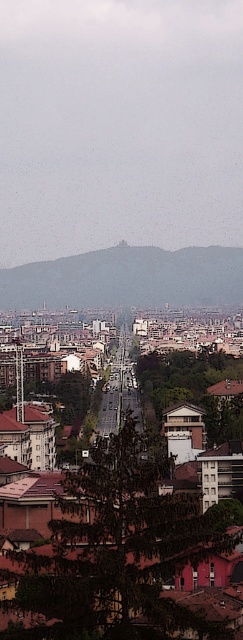
Is the position of brown tiled roofs at center less distant than that of gray stone hillside at center?

Yes, it is.

This screenshot has width=243, height=640. Describe the element at coordinates (121, 532) in the screenshot. I see `brown tiled roofs at center` at that location.

Locate an element on the screen. The height and width of the screenshot is (640, 243). brown tiled roofs at center is located at coordinates (121, 532).